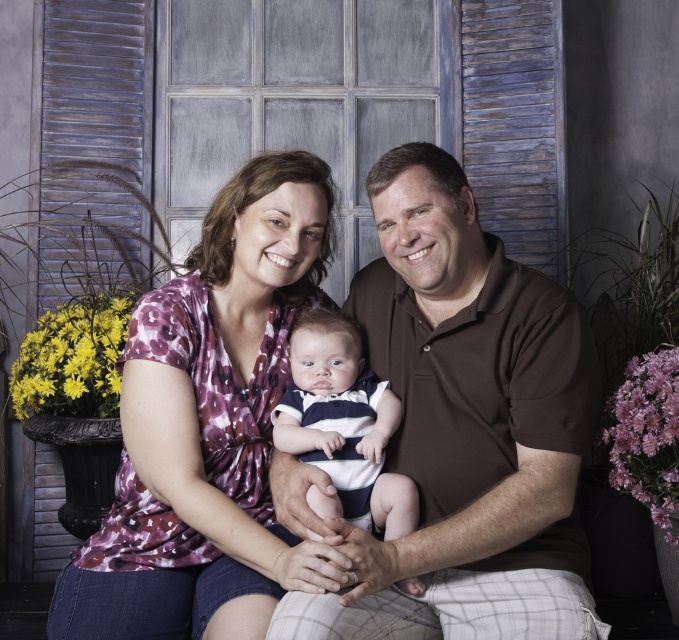
Question: Which object is positioned closest to the brown smooth shirt at center?

Choices:
 (A) purple tie-dye shirt at center
 (B) striped cotton shirt at center

Answer: (B)

Question: Considering the real-world distances, which object is closest to the brown smooth shirt at center?

Choices:
 (A) striped cotton shirt at center
 (B) purple tie-dye shirt at center

Answer: (A)

Question: Does purple tie-dye shirt at center lie behind striped cotton shirt at center?

Choices:
 (A) no
 (B) yes

Answer: (A)

Question: Where is brown smooth shirt at center located in relation to purple tie-dye shirt at center in the image?

Choices:
 (A) below
 (B) above

Answer: (A)

Question: Is brown smooth shirt at center wider than striped cotton shirt at center?

Choices:
 (A) no
 (B) yes

Answer: (B)

Question: Which is farther from the purple tie-dye shirt at center?

Choices:
 (A) brown smooth shirt at center
 (B) striped cotton shirt at center

Answer: (A)